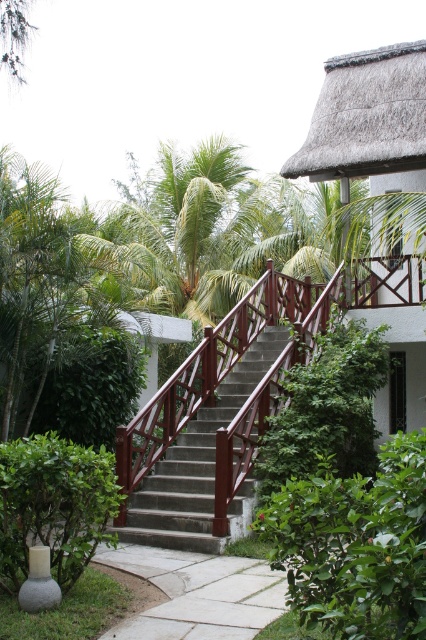
Question: Based on their relative distances, which object is farther from the green leafy bush at center?

Choices:
 (A) green leafy bush at lower right
 (B) smooth concrete stairs at center

Answer: (A)

Question: Which point is farther to the camera?

Choices:
 (A) (412, 340)
 (B) (114, 484)

Answer: (A)

Question: Does green leafy bush at lower right have a smaller size compared to green leafy bush at lower left?

Choices:
 (A) no
 (B) yes

Answer: (A)

Question: Observing the image, what is the correct spatial positioning of green leafy bush at lower left in reference to green leafy bush at left?

Choices:
 (A) above
 (B) below

Answer: (B)

Question: Which point is farther to the camera?

Choices:
 (A) (236, 508)
 (B) (36, 422)
 (C) (385, 54)
 (D) (317, 561)

Answer: (C)

Question: Is thatched roof hut at upper right wider than green leafy bush at left?

Choices:
 (A) yes
 (B) no

Answer: (B)